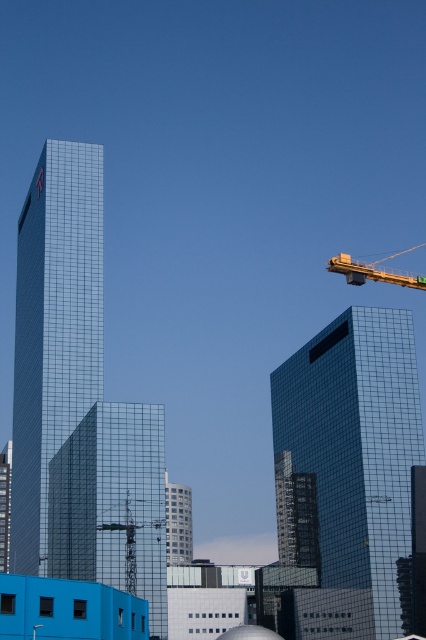
Who is lower down, shiny glass building at center or metallic yellow crane at upper right?

shiny glass building at center is lower down.

Does shiny glass building at center appear on the right side of metallic yellow crane at upper right?

In fact, shiny glass building at center is to the left of metallic yellow crane at upper right.

This screenshot has height=640, width=426. What do you see at coordinates (356, 445) in the screenshot? I see `shiny glass building at center` at bounding box center [356, 445].

I want to click on shiny glass building at center, so click(x=356, y=445).

Consider the image. Does glassy silver tower at center have a lesser width compared to metallic yellow crane at upper right?

Yes.

Does glassy silver tower at center appear on the right side of metallic yellow crane at upper right?

No, glassy silver tower at center is not to the right of metallic yellow crane at upper right.

Does point (175, 500) lie in front of point (373, 264)?

Yes, point (175, 500) is closer to viewer.

The width and height of the screenshot is (426, 640). Identify the location of glassy silver tower at center. (178, 522).

In the scene shown: Does shiny glass tower at center appear on the right side of metallic yellow crane at upper right?

No, shiny glass tower at center is not to the right of metallic yellow crane at upper right.

Between point (149, 605) and point (414, 246), which one is positioned in front?

Positioned in front is point (149, 605).

This screenshot has width=426, height=640. Find the location of `shiny glass tower at center`. shiny glass tower at center is located at coordinates [x=112, y=504].